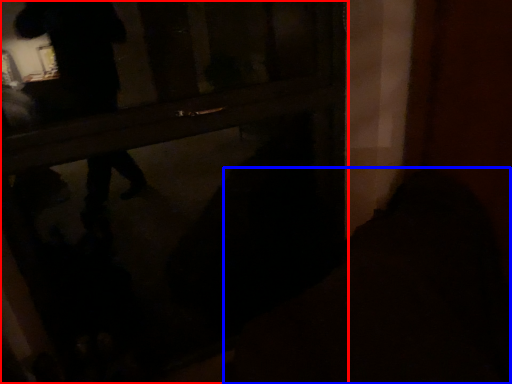
Question: Which object appears closest to the camera in this image, door (highlighted by a red box) or dark (highlighted by a blue box)?

Choices:
 (A) door
 (B) dark

Answer: (B)